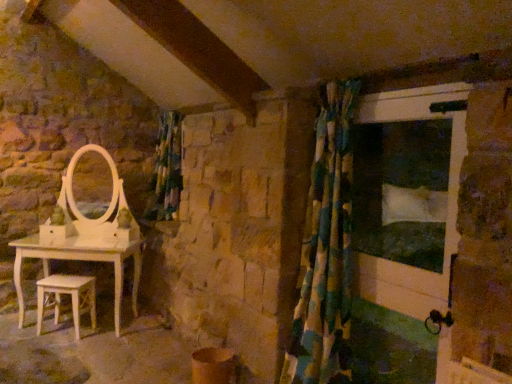
Question: Is green fabric curtain at center bigger than white painted wood screen door at right?

Choices:
 (A) yes
 (B) no

Answer: (A)

Question: Is green fabric curtain at center looking in the opposite direction of white painted wood screen door at right?

Choices:
 (A) yes
 (B) no

Answer: (B)

Question: From the image's perspective, does green fabric curtain at center appear higher than white painted wood screen door at right?

Choices:
 (A) yes
 (B) no

Answer: (A)

Question: Is green fabric curtain at center not inside white painted wood screen door at right?

Choices:
 (A) yes
 (B) no

Answer: (A)

Question: From a real-world perspective, is green fabric curtain at center on top of white painted wood screen door at right?

Choices:
 (A) no
 (B) yes

Answer: (B)

Question: Considering the relative positions of green fabric curtain at center and white painted wood screen door at right in the image provided, is green fabric curtain at center to the right of white painted wood screen door at right from the viewer's perspective?

Choices:
 (A) no
 (B) yes

Answer: (A)

Question: Is the position of white painted wood screen door at right more distant than that of multicolored fabric shower curtain at right?

Choices:
 (A) yes
 (B) no

Answer: (B)

Question: Is white painted wood screen door at right closer to the viewer compared to multicolored fabric shower curtain at right?

Choices:
 (A) no
 (B) yes

Answer: (B)

Question: Is white painted wood screen door at right directly adjacent to multicolored fabric shower curtain at right?

Choices:
 (A) no
 (B) yes

Answer: (A)

Question: From the image's perspective, would you say white painted wood screen door at right is shown under multicolored fabric shower curtain at right?

Choices:
 (A) no
 (B) yes

Answer: (B)

Question: Is white painted wood screen door at right thinner than multicolored fabric shower curtain at right?

Choices:
 (A) no
 (B) yes

Answer: (B)

Question: Could multicolored fabric shower curtain at right be considered to be inside white painted wood screen door at right?

Choices:
 (A) yes
 (B) no

Answer: (B)

Question: Is multicolored fabric shower curtain at right located outside white wooden stool at lower left?

Choices:
 (A) yes
 (B) no

Answer: (A)